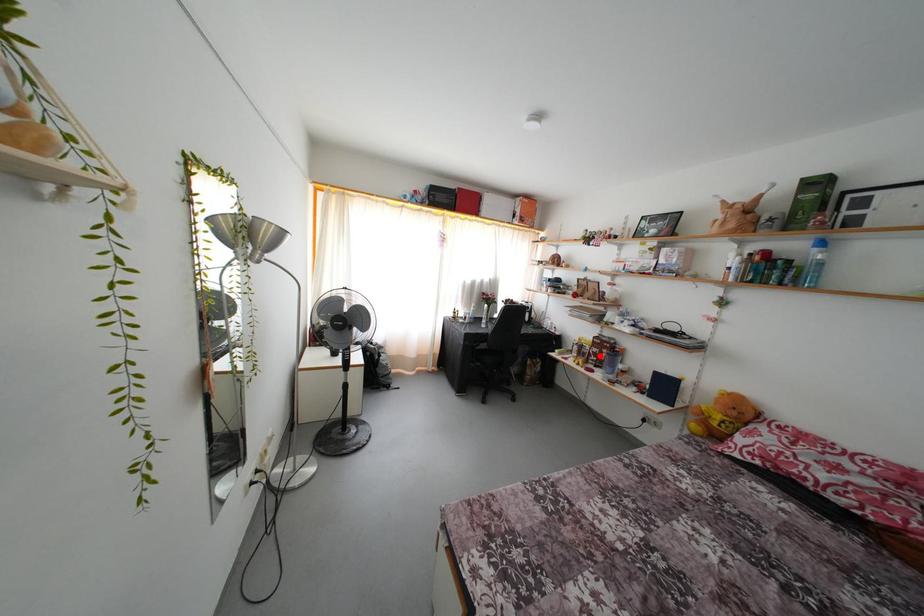
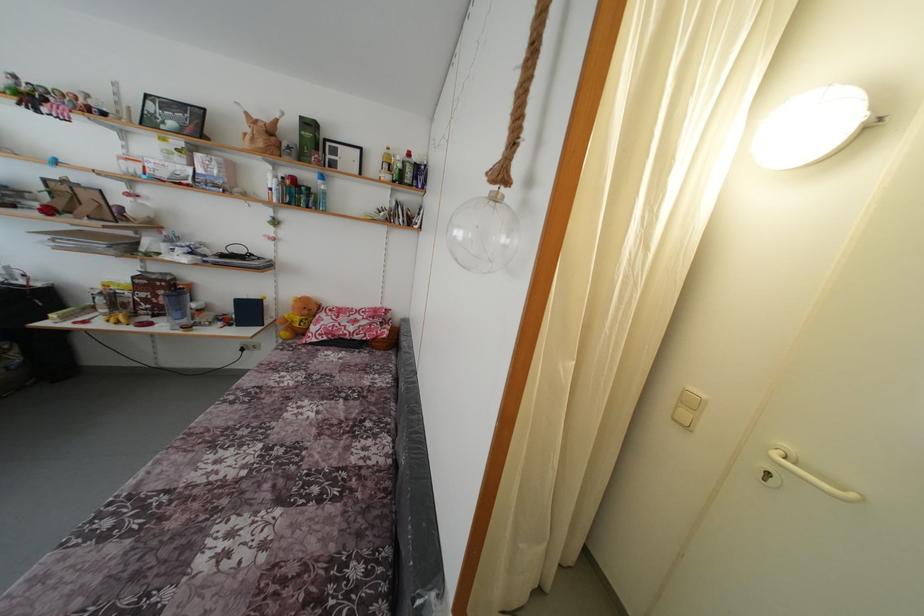
The point at the highlighted location is marked in the first image. Where is the corresponding point in the second image?

(149, 301)